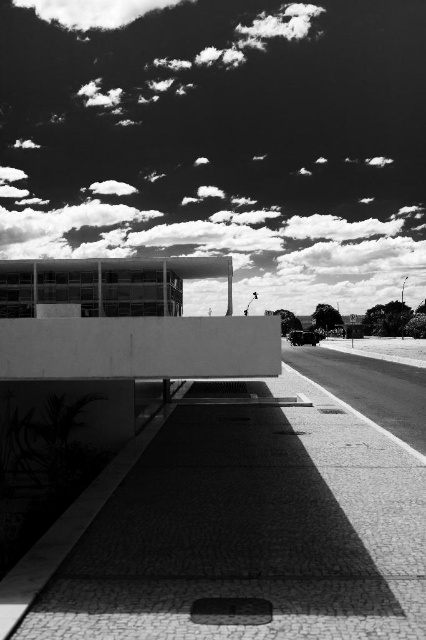
You are an architect analyzing the image of a modern building. You notice two elements in the sky at upper center. Which one is positioned lower between the cloudy sky at upper center and the white fluffy cloud at upper center?

The cloudy sky at upper center is positioned lower than the white fluffy cloud at upper center according to the description.

You are standing in front of the modern architectural structure and want to take a photo of the cloudy sky at upper center and the white fluffy cloud at upper center. How far apart are these two objects in the scene?

The cloudy sky at upper center is 21.07 meters away from the white fluffy cloud at upper center.

You are an architect analyzing the composition of the image. You notice the cloudy sky at upper center and the white fluffy cloud at upper center. Which of these two elements is located to the right side of the other?

The cloudy sky at upper center is positioned on the right side of the white fluffy cloud at upper center.